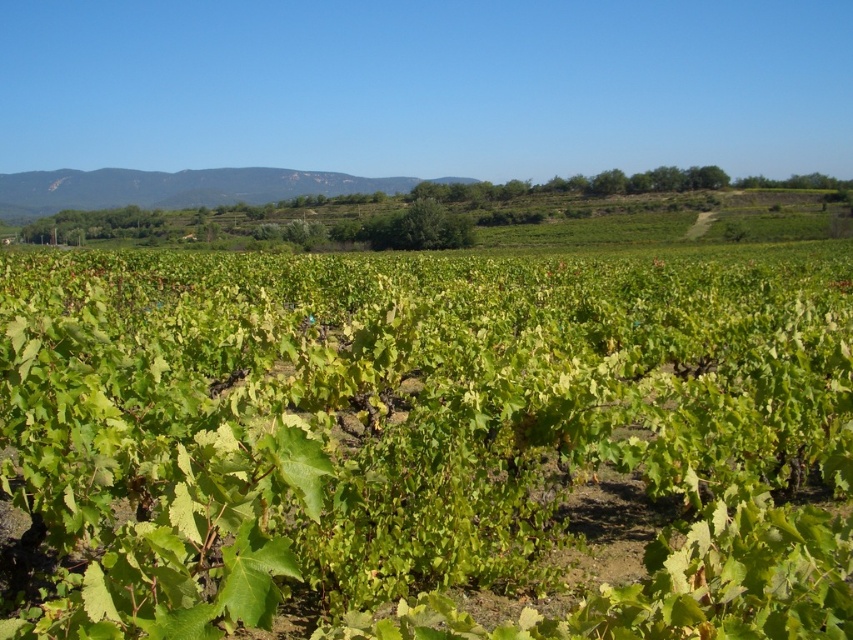
Based on the scene description, where are the green leafy vines at center located in terms of their 2D coordinates?

The green leafy vines at center are located at the 2D coordinates of point (422, 433).

You are a farmer planning to plant new grapevines in the vineyard. You notice the green leafy vines at center and the green grassy hillside at center. Which area would require more space if you want to plant additional grapevines?

The green grassy hillside at center would require more space for planting additional grapevines since the green leafy vines at center are smaller in size compared to the green grassy hillside at center.